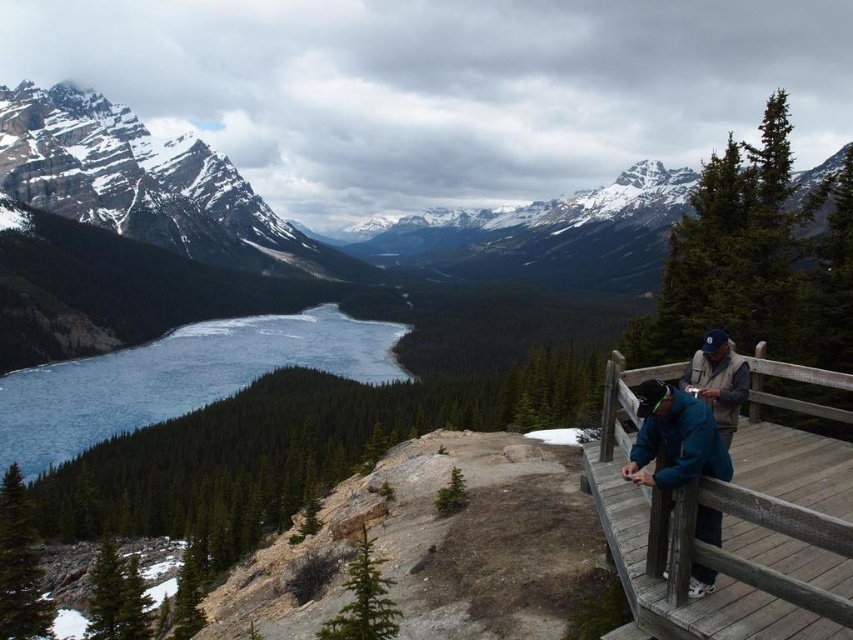
Who is taller, wooden at right or blue denim jacket at upper right?

wooden at right is taller.

Is wooden at right bigger than blue denim jacket at upper right?

Yes, wooden at right is bigger than blue denim jacket at upper right.

You are a GUI agent. You are given a task and a screenshot of the screen. Output one action in this format:
    pyautogui.click(x=<x>, y=<y>)
    Task: Click on the wooden at right
    This screenshot has height=640, width=853.
    Given the screenshot: What is the action you would take?
    pyautogui.click(x=730, y=531)

Between wooden at right and blue fabric jacket at right, which one has less height?

Standing shorter between the two is blue fabric jacket at right.

In the scene shown: Does wooden at right come behind blue fabric jacket at right?

No, it is in front of blue fabric jacket at right.

Which is in front, point (772, 432) or point (724, 420)?

Positioned in front is point (724, 420).

In order to click on wooden at right in this screenshot , I will do `click(730, 531)`.

Which is behind, point (289, 358) or point (735, 362)?

Positioned behind is point (289, 358).

Image resolution: width=853 pixels, height=640 pixels. What do you see at coordinates (178, 378) in the screenshot? I see `blue ice at lower left` at bounding box center [178, 378].

Identify the location of blue ice at lower left. (x=178, y=378).